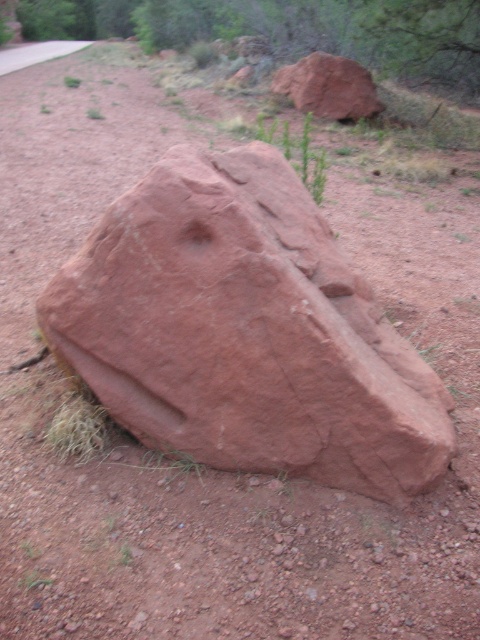
You are standing on the dirt path and want to walk from point A to point B. Point A is at coordinates point (316,198) and point B is at coordinates point (60,44). Which point is closer to you when you start walking?

Point (316,198) is closer to the viewer than point (60,44), so you will start at the closer point when walking from point A to point B.

In the scene shown: You are a hiker trying to cross the path. You see the rusty stone boulder at upper center and the smooth concrete path at upper left. Which one takes up more area in the scene?

The smooth concrete path at upper left takes up more area than the rusty stone boulder at upper center because the rusty stone boulder at upper center occupies less space than smooth concrete path at upper left.

You are a hiker trying to cross the dirt path and notice the rusty stone boulder at upper center and the green leafy plant at center. Which object is taller?

The rusty stone boulder at upper center is taller than the green leafy plant at center.